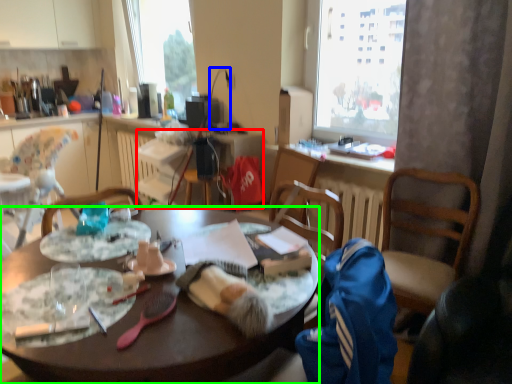
Question: Estimate the real-world distances between objects in this image. Which object is farther from radiator (highlighted by a red box), lamp (highlighted by a blue box) or desk (highlighted by a green box)?

Choices:
 (A) lamp
 (B) desk

Answer: (B)